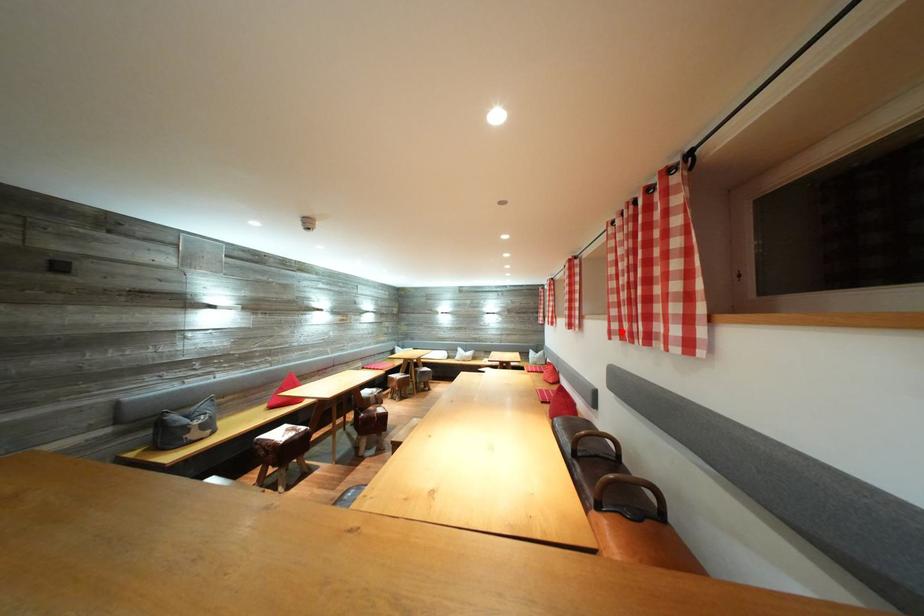
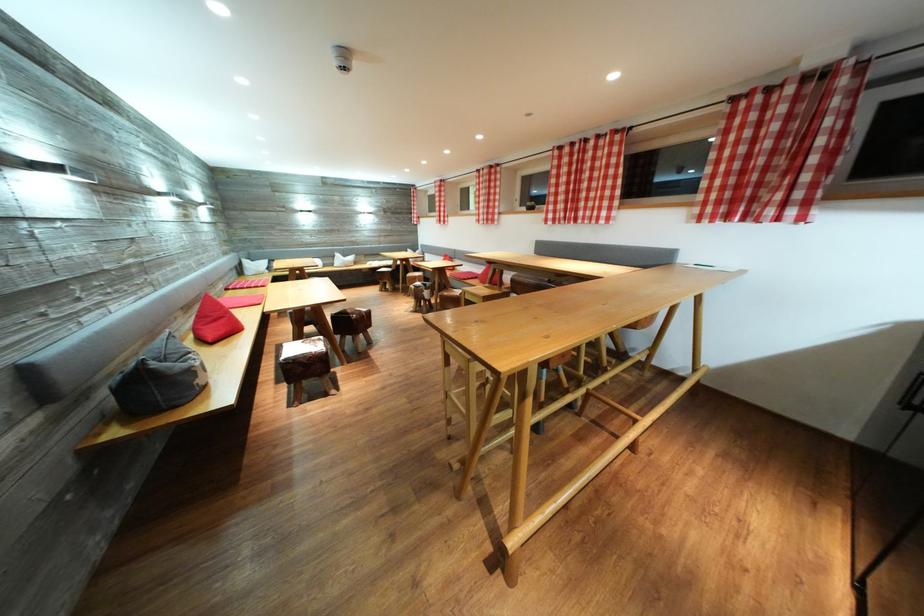
The point at the highlighted location is marked in the first image. Where is the corresponding point in the second image?

(556, 222)